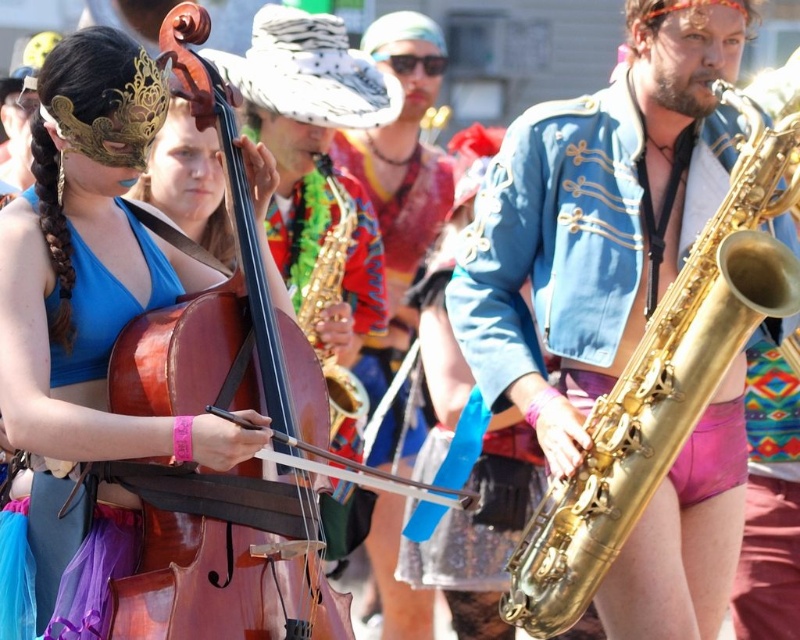
Can you confirm if wooden cello at left is shorter than gold shiny saxophone at right?

No, wooden cello at left is not shorter than gold shiny saxophone at right.

The width and height of the screenshot is (800, 640). What do you see at coordinates (222, 301) in the screenshot? I see `wooden cello at left` at bounding box center [222, 301].

Where is `wooden cello at left`? This screenshot has width=800, height=640. wooden cello at left is located at coordinates (222, 301).

Which of these two, wooden cello at left or matte wood cello at left, stands shorter?

wooden cello at left

Describe the element at coordinates (222, 301) in the screenshot. I see `wooden cello at left` at that location.

Where is `wooden cello at left`? wooden cello at left is located at coordinates (222, 301).

From the picture: Can you confirm if gold shiny saxophone at right is positioned below matte wood cello at left?

No.

Is the position of gold shiny saxophone at right less distant than that of matte wood cello at left?

That is False.

Locate an element on the screen. Image resolution: width=800 pixels, height=640 pixels. gold shiny saxophone at right is located at coordinates (x=664, y=381).